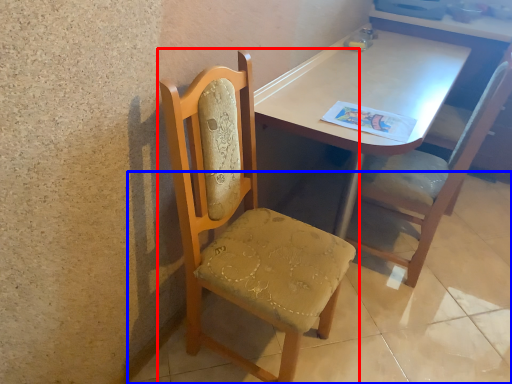
Question: Which point is further to the camera, chair (highlighted by a red box) or concrete (highlighted by a blue box)?

Choices:
 (A) chair
 (B) concrete

Answer: (B)